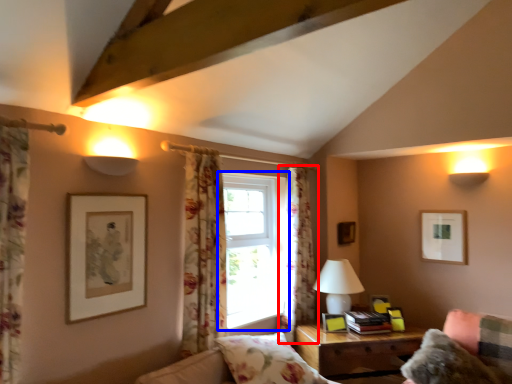
Question: Which of the following is the farthest to the observer, curtain (highlighted by a red box) or window (highlighted by a blue box)?

Choices:
 (A) curtain
 (B) window

Answer: (A)